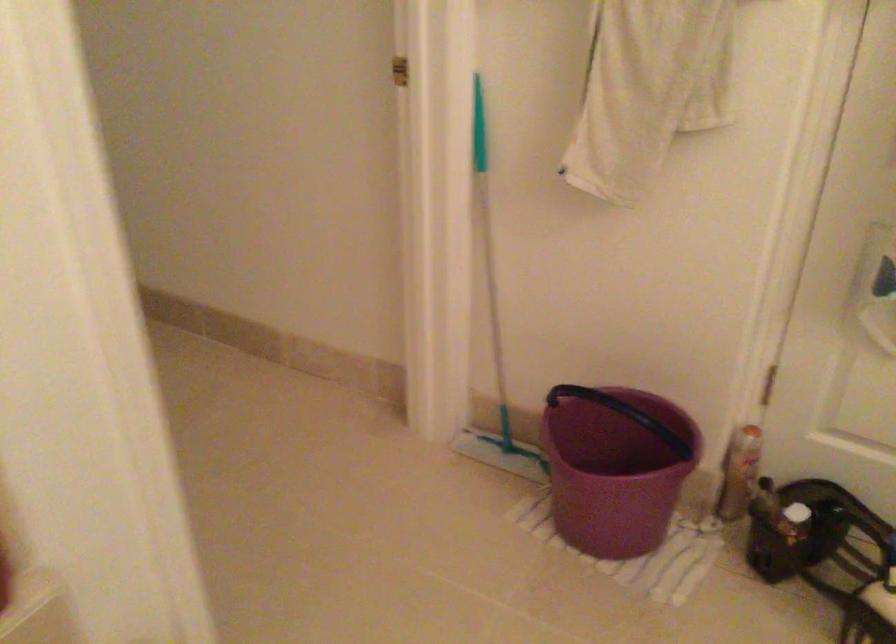
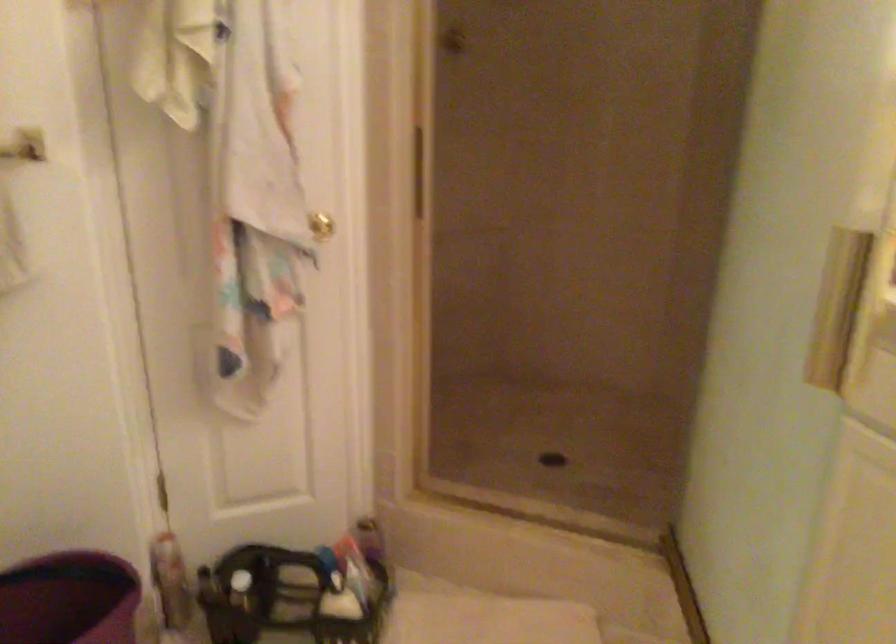
The point at (745, 433) is marked in the first image. Where is the corresponding point in the second image?

(165, 545)